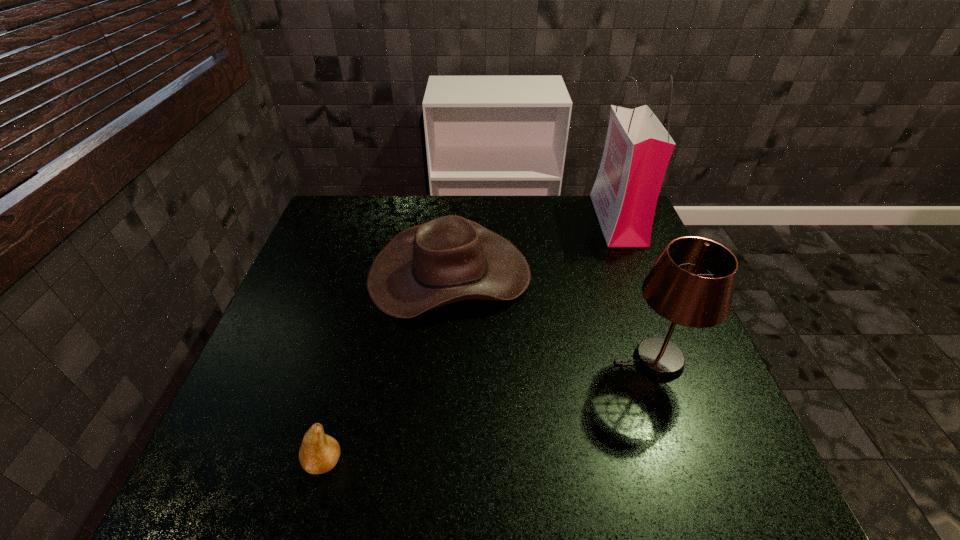
What are the coordinates of `the tallest object` in the screenshot? It's located at (638, 148).

At what (x,y) coordinates should I click in order to perform the action: click on lampshade. Please return your answer as a coordinate pair (x, y). The image size is (960, 540). Looking at the image, I should click on (692, 283).

The width and height of the screenshot is (960, 540). Identify the location of the third shortest object. (692, 283).

Where is `cowboy hat`? The image size is (960, 540). cowboy hat is located at coordinates (449, 259).

In order to click on the shortest object in this screenshot , I will do `click(319, 453)`.

Identify the location of the nearest object. (319, 453).

At what (x,y) coordinates should I click in order to perform the action: click on free region located on the front-facing side of the shopping bag. Please return your answer as a coordinate pair (x, y). The height and width of the screenshot is (540, 960). Looking at the image, I should click on (548, 220).

The width and height of the screenshot is (960, 540). What are the coordinates of `vacant region located on the front-facing side of the shopping bag` in the screenshot? It's located at (508, 220).

This screenshot has width=960, height=540. I want to click on free space located on the front-facing side of the shopping bag, so click(x=476, y=220).

In order to click on vacant space located 0.150m on the front-facing side of the second tallest object in this screenshot , I will do `click(548, 360)`.